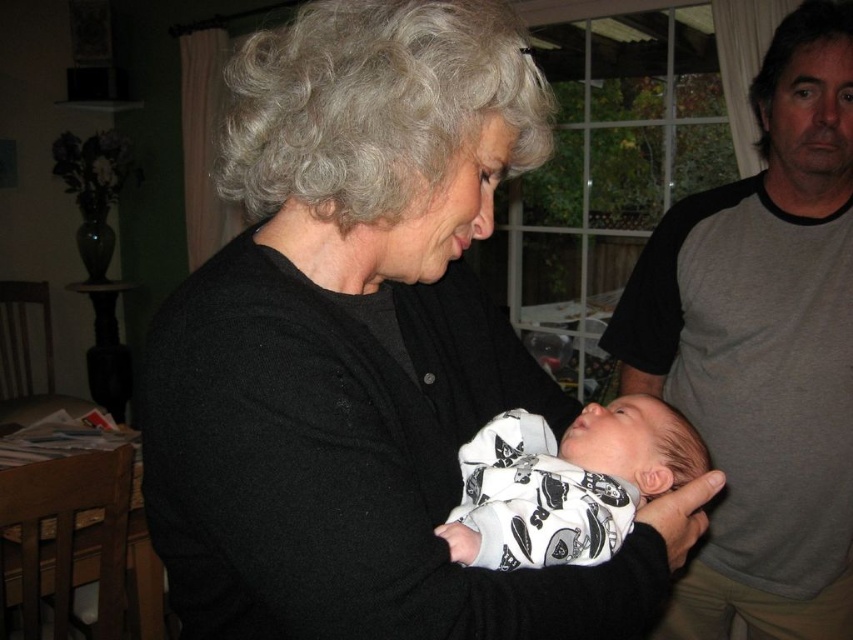
You are a photographer adjusting your camera to focus on two specific points in the image. The first point is at coordinates point [265,60] and the second is at point [711,273]. Which point should you focus on first if you want to capture the closest object in the scene?

Point [265,60] is closer to the viewer than point [711,273], so you should focus on point [265,60] first to capture the closest object in the scene.